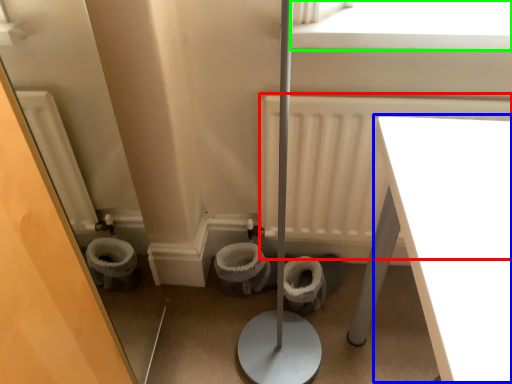
Question: Considering the real-world distances, which object is closest to radiator (highlighted by a red box)? table (highlighted by a blue box) or window screen (highlighted by a green box).

Choices:
 (A) table
 (B) window screen

Answer: (B)